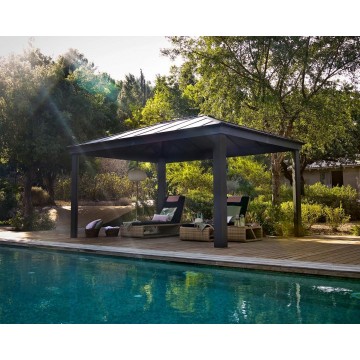
Where is `pillows`? pillows is located at coordinates (162, 217), (227, 220).